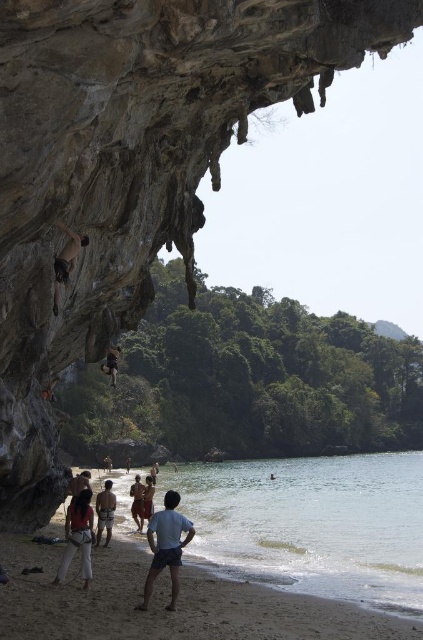
You are a photographer trying to capture the best angle of the rock climbing activity. You want to position yourself at the point labeled as point (x=165, y=602). Based on the scene description, what terrain will you be standing on when you take the photo?

The point (x=165, y=602) corresponds to the smooth sand beach at lower center, so you will be standing on the smooth sand beach at lower center when taking the photo.

You are a photographer positioned at the beach and want to capture a photo of the nude skin rock climber at left and the clear water at lower center. Which object is closer to your camera?

The clear water at lower center is further to the viewer than the nude skin rock climber at left, so the nude skin rock climber at left is closer to the camera.